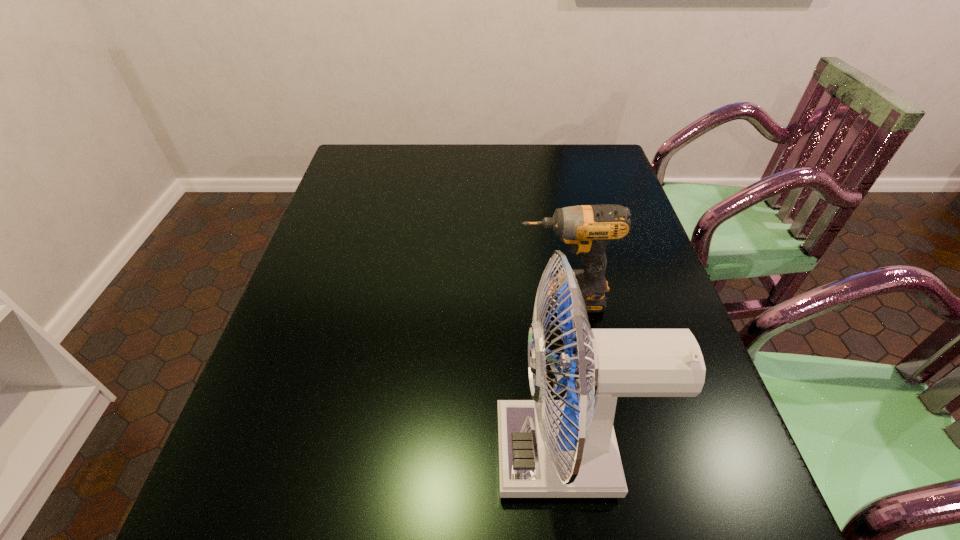
You are a GUI agent. You are given a task and a screenshot of the screen. Output one action in this format:
    pyautogui.click(x=<x>, y=<y>)
    Task: Click on the vacant space at the far right corner
    This screenshot has height=540, width=960.
    Given the screenshot: What is the action you would take?
    pyautogui.click(x=607, y=171)